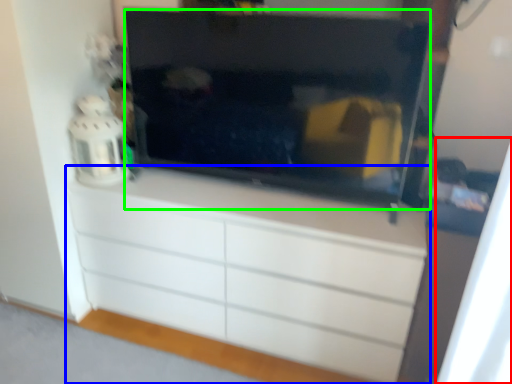
Question: Which object is positioned closest to curtain (highlighted by a red box)? Select from chest of drawers (highlighted by a blue box) and television (highlighted by a green box).

Choices:
 (A) chest of drawers
 (B) television

Answer: (A)